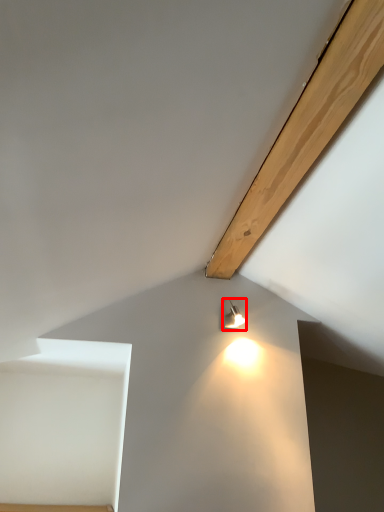
Question: From the image, what is the correct spatial relationship of lamp (annotated by the red box) in relation to plywood?

Choices:
 (A) right
 (B) left

Answer: (B)